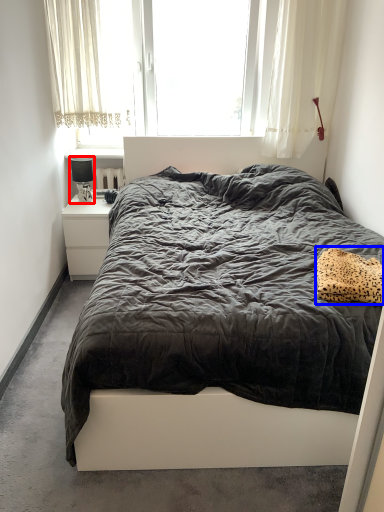
Question: Which object appears closest to the camera in this image, lamp (highlighted by a red box) or pillow (highlighted by a blue box)?

Choices:
 (A) lamp
 (B) pillow

Answer: (B)